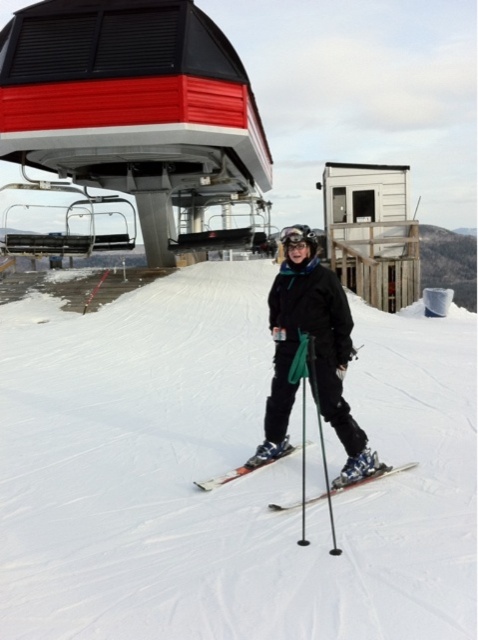
Is point (417, 336) farther from camera compared to point (214, 486)?

Yes, it is.

Image resolution: width=478 pixels, height=640 pixels. I want to click on white snow ski slope at center, so click(x=224, y=470).

Does point (229, 282) lie in front of point (279, 456)?

No, it is behind (279, 456).

Find the location of a particular element. This screenshot has height=640, width=478. white snow ski slope at center is located at coordinates (224, 470).

Between white snow ski slope at center and shiny metallic ski at center, which one appears on the right side from the viewer's perspective?

From the viewer's perspective, shiny metallic ski at center appears more on the right side.

Can you confirm if white snow ski slope at center is positioned below shiny metallic ski at center?

No, white snow ski slope at center is not below shiny metallic ski at center.

What do you see at coordinates (224, 470) in the screenshot? This screenshot has height=640, width=478. I see `white snow ski slope at center` at bounding box center [224, 470].

Find the location of a particular element. Image resolution: width=478 pixels, height=640 pixels. white snow ski slope at center is located at coordinates (224, 470).

Measure the distance from white snow ski slope at center to black matte ski suit at center.

2.55 meters

Does point (223, 600) come behind point (354, 467)?

No.

Identify the location of white snow ski slope at center. The image size is (478, 640). (224, 470).